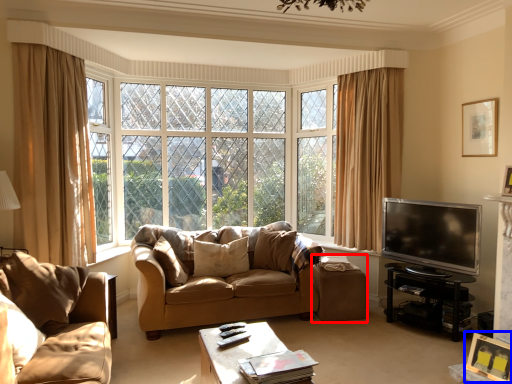
Question: Which object appears closest to the camera in this image, stool (highlighted by a red box) or picture frame (highlighted by a blue box)?

Choices:
 (A) stool
 (B) picture frame

Answer: (B)